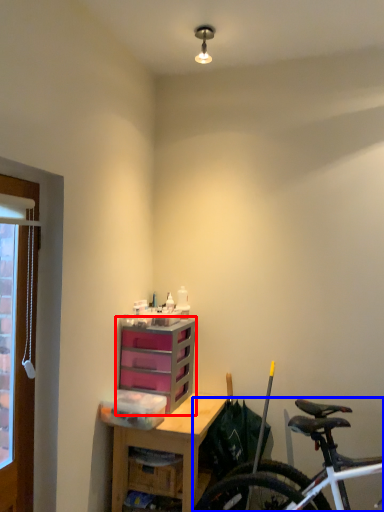
Question: Among these objects, which one is nearest to the camera, chest of drawers (highlighted by a red box) or bicycle (highlighted by a blue box)?

Choices:
 (A) chest of drawers
 (B) bicycle

Answer: (B)